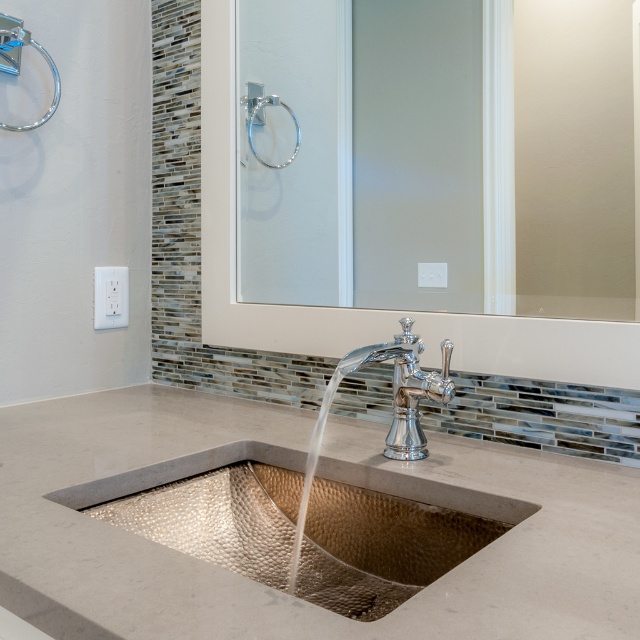
Between hammered copper sink at center and polished chrome faucet at center, which one has less height?

Standing shorter between the two is hammered copper sink at center.

Describe the element at coordinates (320, 474) in the screenshot. I see `hammered copper sink at center` at that location.

I want to click on hammered copper sink at center, so click(320, 474).

Find the location of a particular element. hammered copper sink at center is located at coordinates (320, 474).

Can you confirm if hammered copper sink at center is smaller than clear glass mirror at upper center?

Indeed, hammered copper sink at center has a smaller size compared to clear glass mirror at upper center.

Can you confirm if hammered copper sink at center is positioned below clear glass mirror at upper center?

Yes.

Identify the location of hammered copper sink at center. (320, 474).

Is point (532, 26) positioned before point (413, 401)?

No, (532, 26) is further to viewer.

Is point (355, 74) behind point (410, 323)?

Yes.

Between point (589, 310) and point (400, 353), which one is positioned behind?

The point (400, 353) is behind.

At what (x,y) coordinates should I click in order to perform the action: click on clear glass mirror at upper center. Please return your answer as a coordinate pair (x, y). The width and height of the screenshot is (640, 640). Looking at the image, I should click on (573, 157).